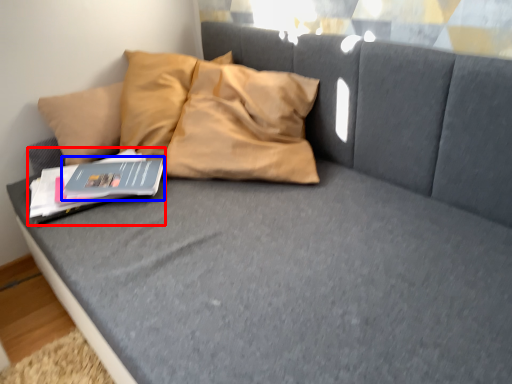
Question: Which object appears closest to the camera in this image, paperback book (highlighted by a red box) or paperback book (highlighted by a blue box)?

Choices:
 (A) paperback book
 (B) paperback book

Answer: (A)